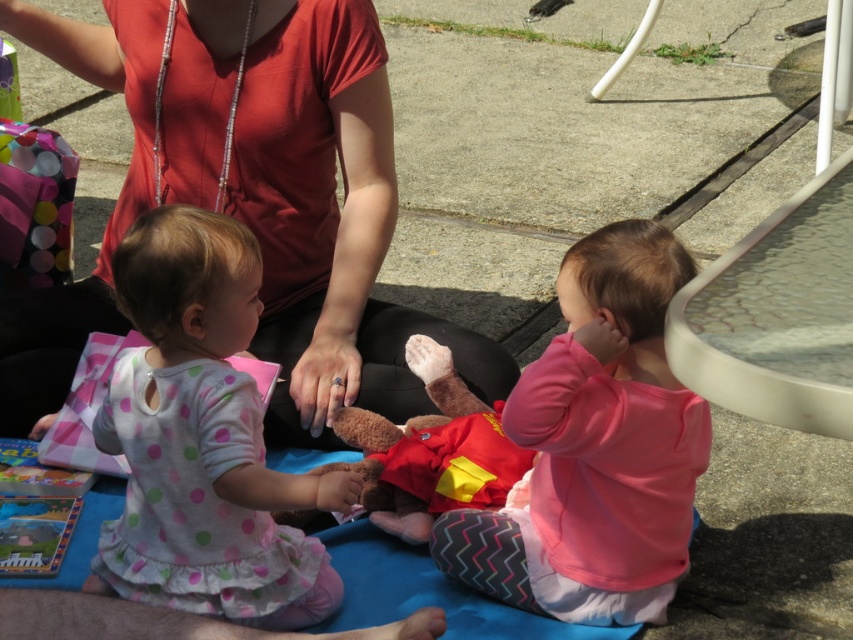
Question: Can you confirm if white polka dot fabric at center is wider than pink fleece sweater at center?

Choices:
 (A) yes
 (B) no

Answer: (A)

Question: Estimate the real-world distances between objects in this image. Which object is farther from the white polka dot fabric at center?

Choices:
 (A) pink fleece sweater at center
 (B) matte red shirt at center

Answer: (A)

Question: Is matte red shirt at center wider than white polka dot fabric at center?

Choices:
 (A) yes
 (B) no

Answer: (A)

Question: Is the position of white polka dot fabric at center more distant than that of pink fleece sweater at center?

Choices:
 (A) yes
 (B) no

Answer: (B)

Question: Among these objects, which one is nearest to the camera?

Choices:
 (A) matte red shirt at center
 (B) pink fleece sweater at center

Answer: (B)

Question: Estimate the real-world distances between objects in this image. Which object is farther from the pink fleece sweater at center?

Choices:
 (A) white polka dot fabric at center
 (B) matte red shirt at center

Answer: (B)